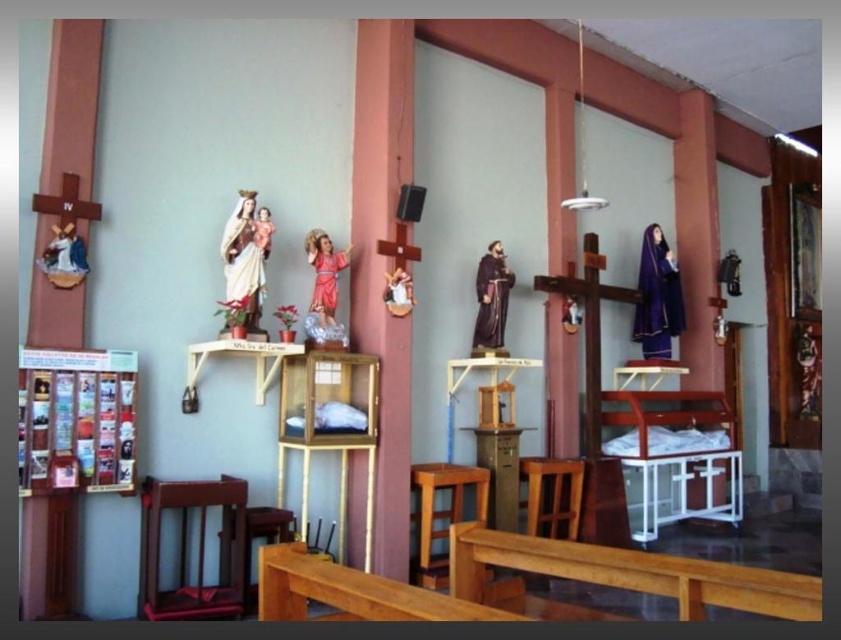
You are a visitor who wants to sit down to rest. You see a wooden stool at lower center and a wooden chair at center. Which one has a wider seat?

The wooden stool at lower center has a wider seat than the wooden chair at center because its width surpasses that of the wooden chair at center.

You are a visitor to the church who wants to sit down and read a pamphlet. You see the wooden cabinet at center and the wooden chair at center. Which object should you interact with to find a place to sit?

The wooden chair at center is larger than the wooden cabinet at center, so you should sit on the wooden chair at center to read the pamphlet.